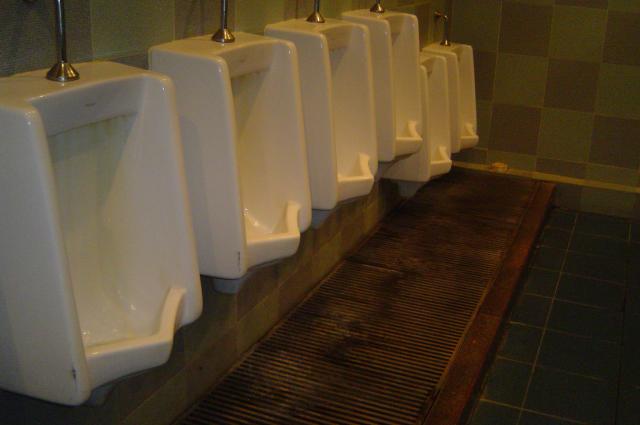
This screenshot has height=425, width=640. I want to click on urinals, so click(81, 202), click(248, 184), click(339, 142), click(403, 107), click(433, 127), click(461, 108).